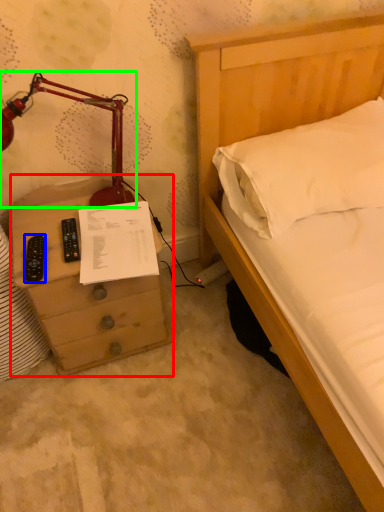
Question: Estimate the real-world distances between objects in this image. Which object is closer to chest of drawers (highlighted by a red box), remote (highlighted by a blue box) or lamp (highlighted by a green box)?

Choices:
 (A) remote
 (B) lamp

Answer: (A)